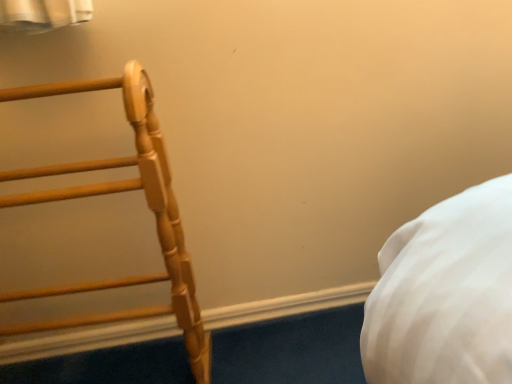
The height and width of the screenshot is (384, 512). Describe the element at coordinates (118, 192) in the screenshot. I see `light brown wooden bedpost at left` at that location.

Where is `light brown wooden bedpost at left`? Image resolution: width=512 pixels, height=384 pixels. light brown wooden bedpost at left is located at coordinates (118, 192).

Locate an element on the screen. The image size is (512, 384). light brown wooden bedpost at left is located at coordinates (118, 192).